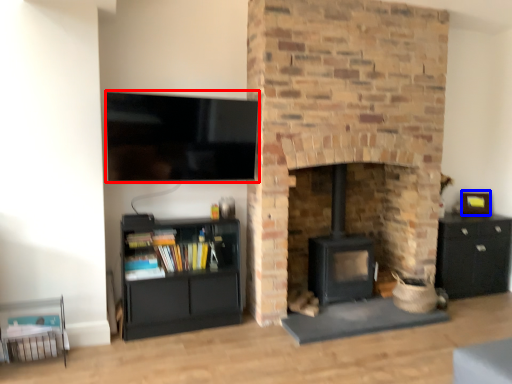
Question: Which point is closer to the camera, television (highlighted by a red box) or picture frame (highlighted by a blue box)?

Choices:
 (A) television
 (B) picture frame

Answer: (A)